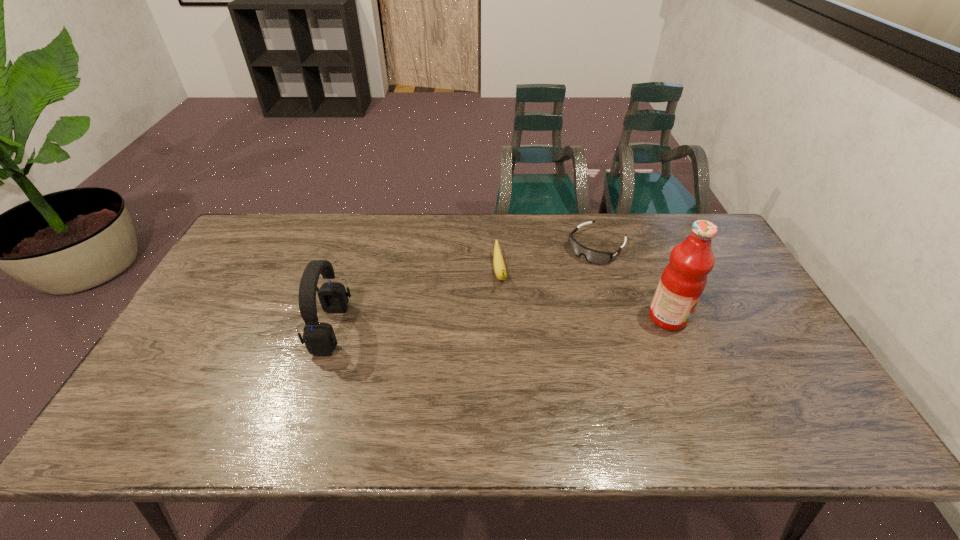
The height and width of the screenshot is (540, 960). I want to click on headset, so click(x=319, y=338).

Where is `the third shortest object`? The height and width of the screenshot is (540, 960). the third shortest object is located at coordinates (319, 338).

Locate an element on the screen. The height and width of the screenshot is (540, 960). the tallest object is located at coordinates (684, 278).

At what (x,y) coordinates should I click in order to perform the action: click on goggles. Please return your answer as a coordinate pair (x, y). Looking at the image, I should click on (593, 256).

Find the location of a particular element. This screenshot has height=540, width=960. the second object from left to right is located at coordinates (499, 267).

Identify the location of the second shortest object. (499, 267).

At what (x,y) coordinates should I click in order to perform the action: click on free space located on the headband of the leftmost object. Please return your answer as a coordinate pair (x, y). The height and width of the screenshot is (540, 960). Looking at the image, I should click on (277, 329).

Where is `vacant region located on the headband of the leftmost object`? The width and height of the screenshot is (960, 540). vacant region located on the headband of the leftmost object is located at coordinates tap(208, 329).

Where is `vacant space located 0.340m on the headband of the leftmost object`? vacant space located 0.340m on the headband of the leftmost object is located at coordinates (190, 329).

What are the coordinates of `blank space located on the front label of the fruit juice` in the screenshot? It's located at (730, 318).